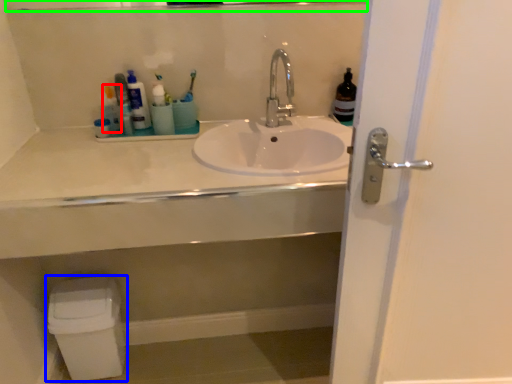
Question: Considering the real-world distances, which object is farthest from toiletry (highlighted by a red box)? toilet bowl (highlighted by a blue box) or mirror (highlighted by a green box)?

Choices:
 (A) toilet bowl
 (B) mirror

Answer: (A)